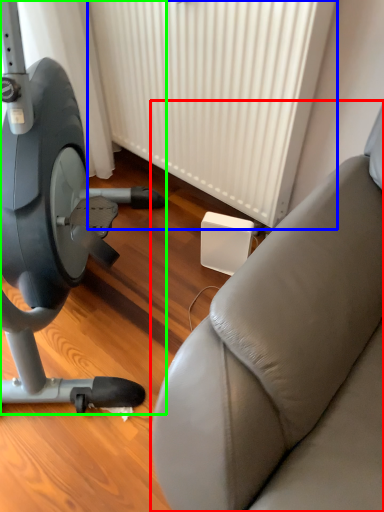
Question: Considering the real-world distances, which object is farthest from studio couch (highlighted by a red box)? radiator (highlighted by a blue box) or stationary bicycle (highlighted by a green box)?

Choices:
 (A) radiator
 (B) stationary bicycle

Answer: (A)